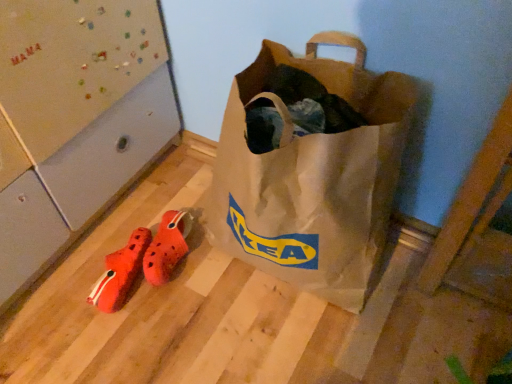
Question: Does orange fabric shoe at lower left come in front of matte brown paper bag at center?

Choices:
 (A) no
 (B) yes

Answer: (A)

Question: Is orange fabric shoe at lower left further to the viewer compared to matte brown paper bag at center?

Choices:
 (A) no
 (B) yes

Answer: (B)

Question: Is orange fabric shoe at lower left surrounding matte brown paper bag at center?

Choices:
 (A) no
 (B) yes

Answer: (A)

Question: Considering the relative positions of orange fabric shoe at lower left and matte brown paper bag at center in the image provided, is orange fabric shoe at lower left to the left of matte brown paper bag at center from the viewer's perspective?

Choices:
 (A) no
 (B) yes

Answer: (B)

Question: Considering the relative sizes of orange fabric shoe at lower left and matte brown paper bag at center in the image provided, is orange fabric shoe at lower left thinner than matte brown paper bag at center?

Choices:
 (A) no
 (B) yes

Answer: (B)

Question: Does orange fabric shoe at lower left have a lesser height compared to matte brown paper bag at center?

Choices:
 (A) yes
 (B) no

Answer: (A)

Question: Is orange rubber clogs at lower left positioned beyond the bounds of orange fabric shoe at lower left?

Choices:
 (A) yes
 (B) no

Answer: (A)

Question: Can you confirm if orange rubber clogs at lower left is positioned to the right of orange fabric shoe at lower left?

Choices:
 (A) no
 (B) yes

Answer: (B)

Question: Is orange rubber clogs at lower left further to the viewer compared to orange fabric shoe at lower left?

Choices:
 (A) no
 (B) yes

Answer: (B)

Question: From a real-world perspective, is orange rubber clogs at lower left positioned under orange fabric shoe at lower left based on gravity?

Choices:
 (A) no
 (B) yes

Answer: (A)

Question: Is orange rubber clogs at lower left directly adjacent to orange fabric shoe at lower left?

Choices:
 (A) no
 (B) yes

Answer: (B)

Question: Would you say orange fabric shoe at lower left is part of orange rubber clogs at lower left's contents?

Choices:
 (A) yes
 (B) no

Answer: (B)

Question: Are orange rubber clogs at lower left and matte brown paper bag at center far apart?

Choices:
 (A) no
 (B) yes

Answer: (A)